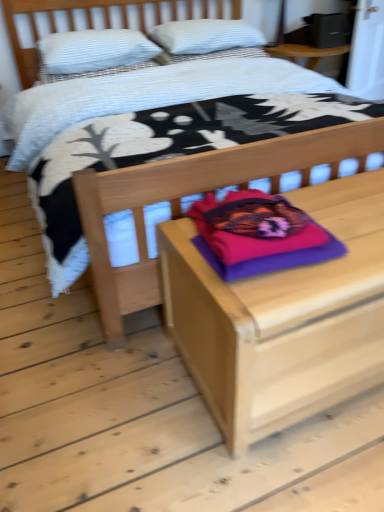
The height and width of the screenshot is (512, 384). What do you see at coordinates (283, 318) in the screenshot?
I see `wooden nightstand at center` at bounding box center [283, 318].

Describe the element at coordinates (94, 20) in the screenshot. I see `wooden bed at center` at that location.

What is the approximate width of white textured pillow at upper center, which is counted as the first pillow, starting from the back?

It is 17.68 inches.

This screenshot has width=384, height=512. What are the coordinates of `wooden nightstand at center` in the screenshot? It's located at (283, 318).

From their relative heights in the image, would you say purple soft pillow at center, the 3th pillow in the back-to-front sequence, is taller or shorter than wooden bed at center?

Clearly, purple soft pillow at center, the 3th pillow in the back-to-front sequence, is shorter compared to wooden bed at center.

In the image, is purple soft pillow at center, which ranks as the 1th pillow in bottom-to-top order, positioned in front of or behind wooden bed at center?

In the image, purple soft pillow at center, which ranks as the 1th pillow in bottom-to-top order, appears behind wooden bed at center.

From the picture: Is the surface of purple soft pillow at center, the first pillow viewed from the front, in direct contact with wooden bed at center?

No, purple soft pillow at center, the first pillow viewed from the front, is not next to wooden bed at center.

Does point (270, 249) lie in front of point (108, 343)?

That is True.

Can you confirm if wooden bed at center is bigger than white textured pillow at upper left, the second pillow viewed from the front?

Yes, wooden bed at center is bigger than white textured pillow at upper left, the second pillow viewed from the front.

Which is farther, [17,22] or [58,70]?

The point [17,22] is farther from the camera.

Is wooden bed at center not within white textured pillow at upper left, the second pillow in the bottom-to-top sequence?

Yes, wooden bed at center is located beyond the bounds of white textured pillow at upper left, the second pillow in the bottom-to-top sequence.

Image resolution: width=384 pixels, height=512 pixels. Find the location of `bed lying below the white textured pillow at upper left, the second pillow viewed from the front (from the image's perspective)`. bed lying below the white textured pillow at upper left, the second pillow viewed from the front (from the image's perspective) is located at coordinates (94, 20).

Between point (133, 282) and point (315, 254), which one is positioned in front?

The point (315, 254) is closer to the camera.

Who is shorter, wooden bed at center or purple soft pillow at center, the 3th pillow in the back-to-front sequence?

purple soft pillow at center, the 3th pillow in the back-to-front sequence.

From the image's perspective, which is above, wooden bed at center or purple soft pillow at center, which ranks as the third pillow in top-to-bottom order?

wooden bed at center appears higher in the image.

Who is bigger, white textured pillow at upper left, acting as the 2th pillow starting from the back, or wooden bed at center?

With larger size is wooden bed at center.

Is the surface of white textured pillow at upper left, the second pillow in the bottom-to-top sequence, in direct contact with wooden bed at center?

No, white textured pillow at upper left, the second pillow in the bottom-to-top sequence, is not in contact with wooden bed at center.

From a real-world perspective, is white textured pillow at upper left, acting as the 2th pillow starting from the back, over wooden bed at center?

Correct, in the physical world, white textured pillow at upper left, acting as the 2th pillow starting from the back, is higher than wooden bed at center.

Is white textured pillow at upper left, acting as the 2th pillow starting from the back, completely or partially outside of wooden bed at center?

No, most part of white textured pillow at upper left, acting as the 2th pillow starting from the back, lies within wooden bed at center.

Is wooden nightstand at center not inside wooden bed at center?

Absolutely, wooden nightstand at center is external to wooden bed at center.

Between wooden nightstand at center and wooden bed at center, which one appears on the left side from the viewer's perspective?

From the viewer's perspective, wooden bed at center appears more on the left side.

Is point (297, 282) behind point (107, 282)?

That is False.

From the image's perspective, between wooden bed at center and wooden nightstand at center, who is located below?

wooden nightstand at center.

Would you say wooden bed at center is a long distance from wooden nightstand at center?

Yes.

Which of these two, wooden bed at center or wooden nightstand at center, is wider?

Wider between the two is wooden bed at center.

Who is taller, wooden bed at center or wooden nightstand at center?

Standing taller between the two is wooden bed at center.

In terms of height, does wooden nightstand at center look taller or shorter compared to white textured pillow at upper center, arranged as the 3th pillow when ordered from the bottom?

Considering their sizes, wooden nightstand at center has more height than white textured pillow at upper center, arranged as the 3th pillow when ordered from the bottom.

In the scene shown: From the image's perspective, is wooden nightstand at center on top of white textured pillow at upper center, which appears as the first pillow when viewed from the top?

No.

Is wooden nightstand at center to the left or to the right of white textured pillow at upper center, arranged as the 3th pillow when ordered from the bottom, in the image?

From the image, it's evident that wooden nightstand at center is to the right of white textured pillow at upper center, arranged as the 3th pillow when ordered from the bottom.

Between point (278, 317) and point (182, 41), which one is positioned in front?

Positioned in front is point (278, 317).

Where is `bed lying above the purple soft pillow at center, which ranks as the third pillow in top-to-bottom order (from the image's perspective)`? This screenshot has width=384, height=512. bed lying above the purple soft pillow at center, which ranks as the third pillow in top-to-bottom order (from the image's perspective) is located at coordinates (94, 20).

Where is `pillow on the left of wooden bed at center`? This screenshot has width=384, height=512. pillow on the left of wooden bed at center is located at coordinates (94, 50).

Based on their spatial positions, is white textured pillow at upper center, which appears as the first pillow when viewed from the top, or purple soft pillow at center, the 3th pillow in the back-to-front sequence, closer to white textured pillow at upper left, acting as the 2th pillow starting from the back?

white textured pillow at upper center, which appears as the first pillow when viewed from the top.

From the image, which object appears to be farther from wooden nightstand at center, wooden bed at center or purple soft pillow at center, the 3th pillow in the back-to-front sequence?

Based on the image, wooden bed at center appears to be further to wooden nightstand at center.

When comparing their distances from white textured pillow at upper left, which is the second pillow from top to bottom, does purple soft pillow at center, which ranks as the 1th pillow in bottom-to-top order, or wooden bed at center seem closer?

wooden bed at center lies closer to white textured pillow at upper left, which is the second pillow from top to bottom, than the other object.

From the image, which object appears to be farther from white textured pillow at upper center, which appears as the first pillow when viewed from the top, wooden bed at center or white textured pillow at upper left, the second pillow in the bottom-to-top sequence?

Based on the image, white textured pillow at upper left, the second pillow in the bottom-to-top sequence, appears to be further to white textured pillow at upper center, which appears as the first pillow when viewed from the top.

Which object lies further to the anchor point purple soft pillow at center, the 3th pillow in the back-to-front sequence, wooden nightstand at center or white textured pillow at upper center, which appears as the first pillow when viewed from the top?

white textured pillow at upper center, which appears as the first pillow when viewed from the top, is further to purple soft pillow at center, the 3th pillow in the back-to-front sequence.

From the picture: From the image, which object appears to be farther from purple soft pillow at center, which ranks as the 1th pillow in bottom-to-top order, wooden nightstand at center or wooden bed at center?

wooden bed at center is further to purple soft pillow at center, which ranks as the 1th pillow in bottom-to-top order.

Which object lies nearer to the anchor point white textured pillow at upper left, which is the second pillow from top to bottom, wooden nightstand at center or white textured pillow at upper center, marked as the third pillow in a front-to-back arrangement?

Based on the image, white textured pillow at upper center, marked as the third pillow in a front-to-back arrangement, appears to be nearer to white textured pillow at upper left, which is the second pillow from top to bottom.

Which object lies further to the anchor point white textured pillow at upper left, the second pillow viewed from the front, wooden bed at center or purple soft pillow at center, the first pillow viewed from the front?

purple soft pillow at center, the first pillow viewed from the front, lies further to white textured pillow at upper left, the second pillow viewed from the front, than the other object.

I want to click on pillow located between wooden nightstand at center and white textured pillow at upper left, acting as the 2th pillow starting from the back, in the depth direction, so click(x=258, y=234).

Identify the location of pillow between purple soft pillow at center, which ranks as the third pillow in top-to-bottom order, and white textured pillow at upper center, which appears as the first pillow when viewed from the top, in the front-back direction. (94, 50).

Find the location of a particular element. The image size is (384, 512). pillow positioned between wooden bed at center and white textured pillow at upper left, acting as the 2th pillow starting from the back, from near to far is located at coordinates (258, 234).

Locate an element on the screen. The height and width of the screenshot is (512, 384). pillow between wooden bed at center and wooden nightstand at center vertically is located at coordinates (258, 234).